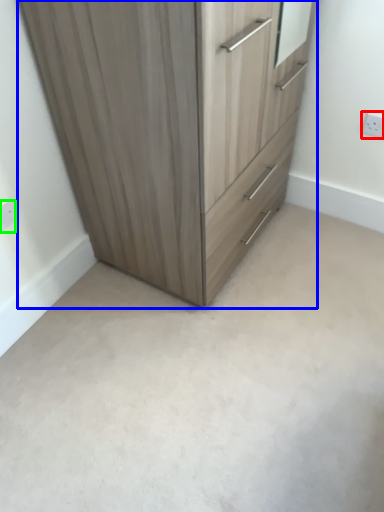
Question: Which object is the closest to the electric outlet (highlighted by a red box)? Choose among these: chest of drawers (highlighted by a blue box) or electric outlet (highlighted by a green box).

Choices:
 (A) chest of drawers
 (B) electric outlet

Answer: (A)